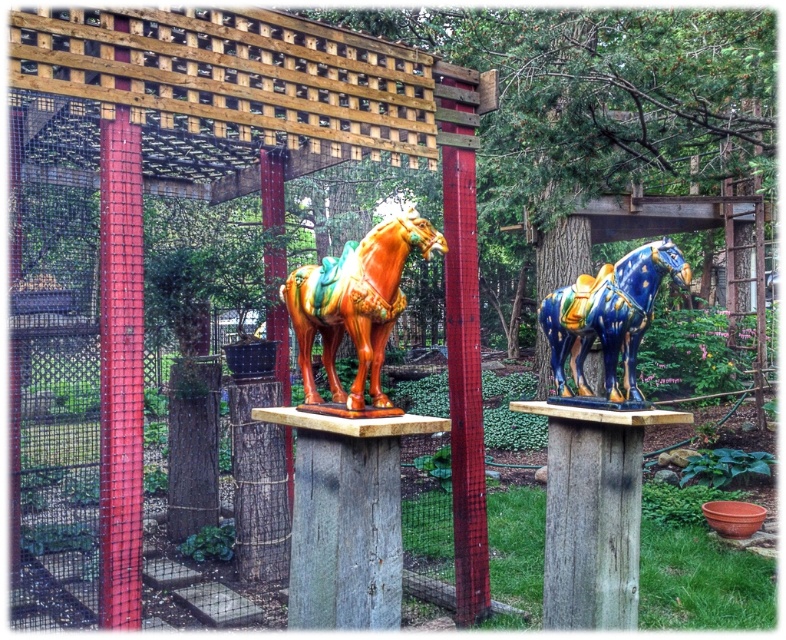
In the scene shown: You are standing in the garden and see the shiny orange horse at center. Can you tell me where the point at coordinates point (355,305) is located?

The point at coordinates point (355,305) is located on the shiny orange horse at center.

You are a visitor in the garden and want to take a photo of both the shiny orange horse at center and the blue glossy horse at center. Which horse should you focus on first if you want to capture both in the frame without moving your camera?

You should focus on the shiny orange horse at center first because it is taller than the blue glossy horse at center, ensuring it fits within the frame when positioned appropriately.